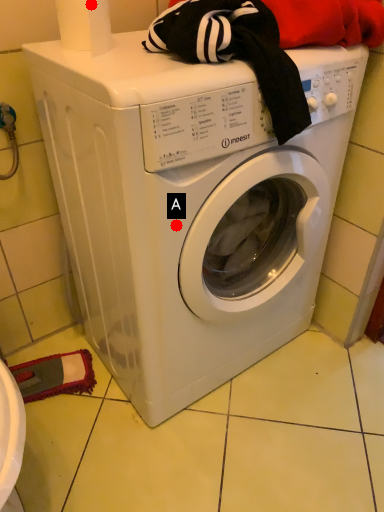
Question: Two points are circled on the image, labeled by A and B beside each circle. Which point is further to the camera?

Choices:
 (A) A is further
 (B) B is further

Answer: (B)